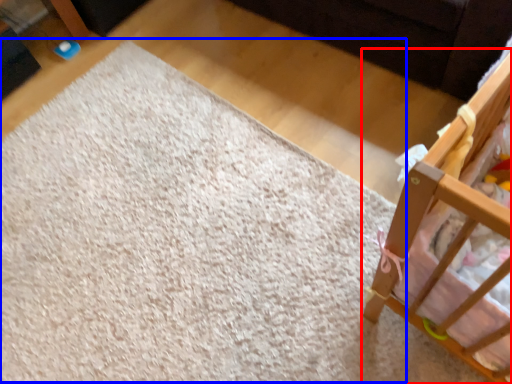
Question: Among these objects, which one is farthest to the camera, infant bed (highlighted by a red box) or mat (highlighted by a blue box)?

Choices:
 (A) infant bed
 (B) mat

Answer: (B)